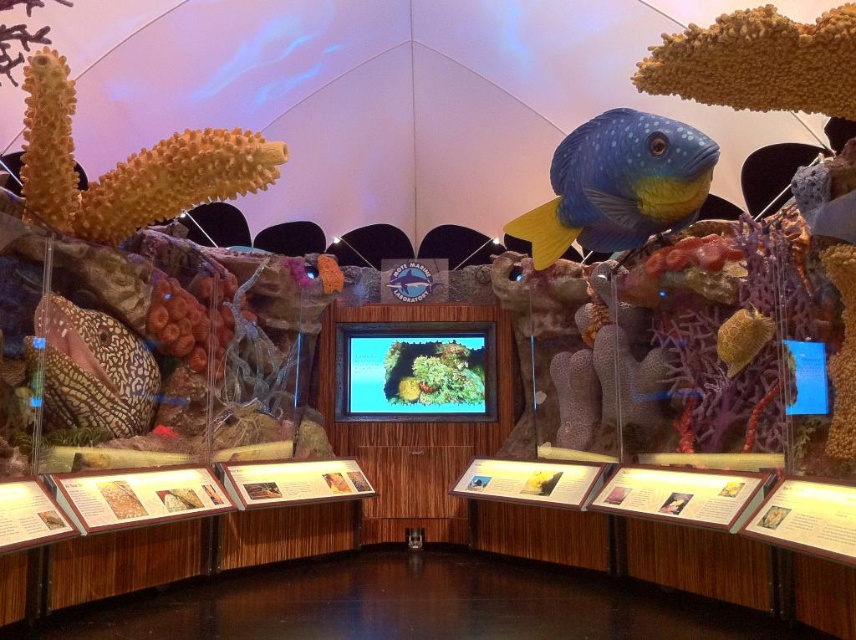
Does speckled gold fish at left have a larger size compared to smooth yellowish-brown seashell at right?

Yes.

I want to click on speckled gold fish at left, so click(92, 369).

Which is in front, point (58, 384) or point (742, 344)?

Point (742, 344)

Image resolution: width=856 pixels, height=640 pixels. What are the coordinates of `speckled gold fish at left` in the screenshot? It's located at (92, 369).

From the picture: Who is shorter, blue matte fish at center or speckled gold fish at left?

With less height is speckled gold fish at left.

Is point (625, 228) farther from camera compared to point (48, 401)?

That is True.

Identify the location of blue matte fish at center. The width and height of the screenshot is (856, 640). (617, 184).

Who is positioned more to the left, blue matte fish at center or smooth yellowish-brown seashell at right?

Positioned to the left is blue matte fish at center.

Is blue matte fish at center to the left of smooth yellowish-brown seashell at right from the viewer's perspective?

Yes, blue matte fish at center is to the left of smooth yellowish-brown seashell at right.

Does point (554, 182) lie behind point (752, 328)?

Yes, it is.

Find the location of a particular element. This screenshot has height=640, width=856. blue matte fish at center is located at coordinates (617, 184).